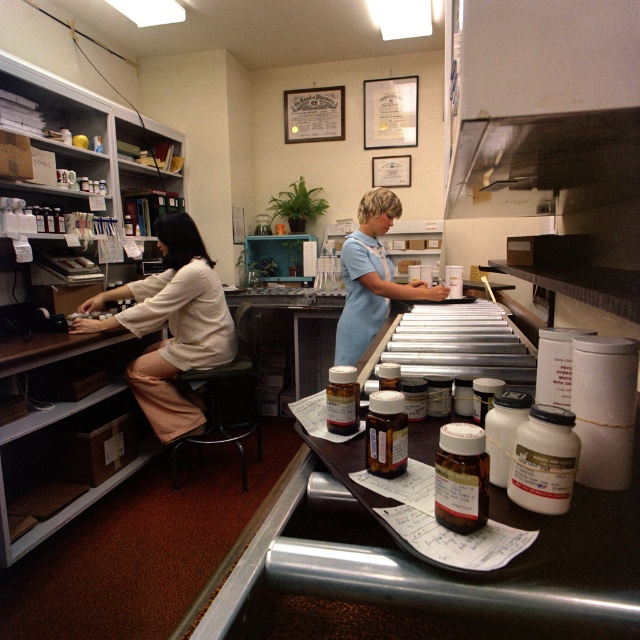
You are a customer in the pharmacy and need to determine which employee is closer to the entrance. The entrance is located to the right side of the pharmacy. You see the matte white blouse at left and the light blue uniform at center. Which employee is closer to the entrance?

The light blue uniform at center is closer to the entrance than the matte white blouse at left because the entrance is on the right side of the pharmacy and the light blue uniform is positioned more towards the center, which is closer to the right side compared to the left position of the matte white blouse.

You are a customer entering the pharmacy and see the matte white blouse at left and the light blue uniform at center. Which clothing item is positioned higher up in the image?

Result: The matte white blouse at left is much taller as light blue uniform at center, so the matte white blouse at left is positioned higher up in the image.